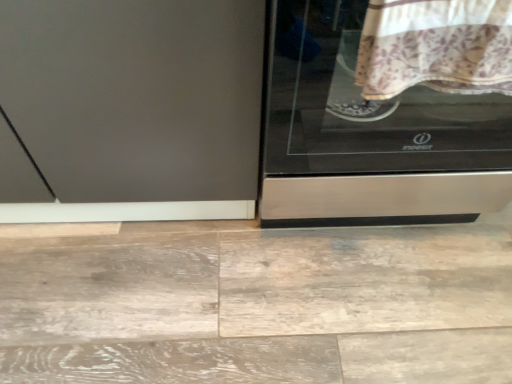
What do you see at coordinates (388, 112) in the screenshot? I see `stainless steel cooktop at right` at bounding box center [388, 112].

Identify the location of matte gray screen door at left. The width and height of the screenshot is (512, 384). (132, 108).

Between stainless steel cooktop at right and matte gray screen door at left, which one has more height?

With more height is stainless steel cooktop at right.

From the image's perspective, is stainless steel cooktop at right on matte gray screen door at left?

Actually, stainless steel cooktop at right appears below matte gray screen door at left in the image.

How many degrees apart are the facing directions of stainless steel cooktop at right and matte gray screen door at left?

The facing directions of stainless steel cooktop at right and matte gray screen door at left are 1.09 degrees apart.

Which object is further away from the camera, stainless steel cooktop at right or matte gray screen door at left?

Positioned behind is matte gray screen door at left.

Considering the relative sizes of stainless steel cooktop at right and floral cotton blanket at upper right in the image provided, is stainless steel cooktop at right smaller than floral cotton blanket at upper right?

Actually, stainless steel cooktop at right might be larger than floral cotton blanket at upper right.

In the scene shown: Can you confirm if stainless steel cooktop at right is shorter than floral cotton blanket at upper right?

Incorrect, the height of stainless steel cooktop at right does not fall short of that of floral cotton blanket at upper right.

Where is `blanket in front of the stainless steel cooktop at right`? This screenshot has width=512, height=384. blanket in front of the stainless steel cooktop at right is located at coordinates [435, 47].

From a real-world perspective, which object stands above the other?

floral cotton blanket at upper right, from a real-world perspective.

Which of these two, matte gray screen door at left or stainless steel cooktop at right, is bigger?

matte gray screen door at left is bigger.

Is matte gray screen door at left taller than stainless steel cooktop at right?

No, matte gray screen door at left is not taller than stainless steel cooktop at right.

Locate an element on the screen. This screenshot has height=384, width=512. screen door that appears on the left of stainless steel cooktop at right is located at coordinates (132, 108).

Looking at this image, is floral cotton blanket at upper right situated inside matte gray screen door at left or outside?

floral cotton blanket at upper right is not inside matte gray screen door at left, it's outside.

From the image's perspective, is floral cotton blanket at upper right over matte gray screen door at left?

No, from the image's perspective, floral cotton blanket at upper right is not over matte gray screen door at left.

Is floral cotton blanket at upper right next to matte gray screen door at left and touching it?

No, floral cotton blanket at upper right is not in contact with matte gray screen door at left.

Does floral cotton blanket at upper right have a smaller size compared to matte gray screen door at left?

Indeed, floral cotton blanket at upper right has a smaller size compared to matte gray screen door at left.

Does floral cotton blanket at upper right appear on the left side of stainless steel cooktop at right?

No, floral cotton blanket at upper right is not to the left of stainless steel cooktop at right.

Find the location of a particular element. This screenshot has width=512, height=384. home appliance above the floral cotton blanket at upper right (from the image's perspective) is located at coordinates (388, 112).

From the picture: From the image's perspective, is floral cotton blanket at upper right on stainless steel cooktop at right?

Actually, floral cotton blanket at upper right appears below stainless steel cooktop at right in the image.

Does floral cotton blanket at upper right come in front of stainless steel cooktop at right?

Yes.

Considering the sizes of matte gray screen door at left and floral cotton blanket at upper right in the image, is matte gray screen door at left wider or thinner than floral cotton blanket at upper right?

In the image, matte gray screen door at left appears to be wider than floral cotton blanket at upper right.

In terms of height, does matte gray screen door at left look taller or shorter compared to floral cotton blanket at upper right?

Considering their sizes, matte gray screen door at left has more height than floral cotton blanket at upper right.

Locate an element on the screen. This screenshot has width=512, height=384. blanket that appears on the right of matte gray screen door at left is located at coordinates (435, 47).

The height and width of the screenshot is (384, 512). In the image, there is a stainless steel cooktop at right. In order to click on screen door below it (from a real-world perspective) in this screenshot , I will do `click(132, 108)`.

Image resolution: width=512 pixels, height=384 pixels. In order to click on home appliance to the left of floral cotton blanket at upper right in this screenshot , I will do `click(388, 112)`.

From the image, which object appears to be nearer to stainless steel cooktop at right, matte gray screen door at left or floral cotton blanket at upper right?

Among the two, floral cotton blanket at upper right is located nearer to stainless steel cooktop at right.

Estimate the real-world distances between objects in this image. Which object is closer to matte gray screen door at left, stainless steel cooktop at right or floral cotton blanket at upper right?

Among the two, stainless steel cooktop at right is located nearer to matte gray screen door at left.

Based on their spatial positions, is floral cotton blanket at upper right or matte gray screen door at left further from stainless steel cooktop at right?

matte gray screen door at left is further to stainless steel cooktop at right.

Which object lies further to the anchor point floral cotton blanket at upper right, matte gray screen door at left or stainless steel cooktop at right?

The object further to floral cotton blanket at upper right is matte gray screen door at left.

Based on their spatial positions, is floral cotton blanket at upper right or stainless steel cooktop at right further from matte gray screen door at left?

floral cotton blanket at upper right is further to matte gray screen door at left.

Estimate the real-world distances between objects in this image. Which object is further from floral cotton blanket at upper right, stainless steel cooktop at right or matte gray screen door at left?

matte gray screen door at left.

Where is `home appliance located between matte gray screen door at left and floral cotton blanket at upper right in the left-right direction`? home appliance located between matte gray screen door at left and floral cotton blanket at upper right in the left-right direction is located at coordinates (388, 112).